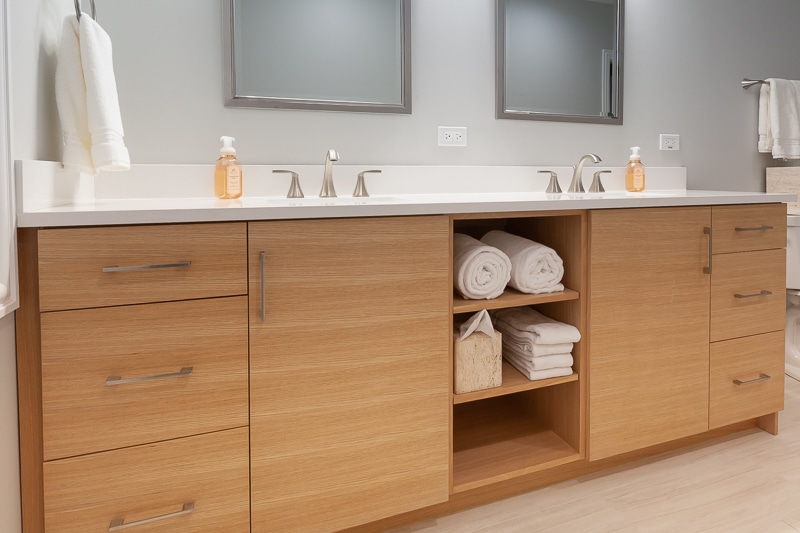
Locate an element on the screen. Image resolution: width=800 pixels, height=533 pixels. right drawers is located at coordinates (761, 224), (746, 290), (740, 395).